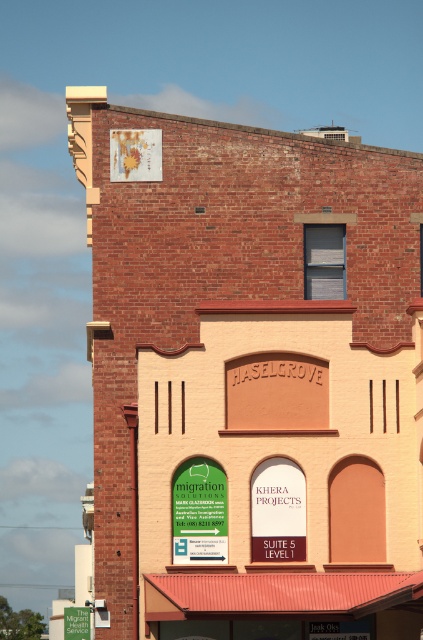
Question: Which object is positioned closest to the green plastic sign at lower left?

Choices:
 (A) metallic red awning at lower center
 (B) brick building at center

Answer: (A)

Question: Which point is closer to the camera?

Choices:
 (A) brick building at center
 (B) metallic red awning at lower center

Answer: (B)

Question: Based on their relative distances, which object is nearer to the green plastic sign at lower left?

Choices:
 (A) brick building at center
 (B) metallic red awning at lower center

Answer: (B)

Question: Is brick building at center above metallic red awning at lower center?

Choices:
 (A) yes
 (B) no

Answer: (A)

Question: Can you confirm if metallic red awning at lower center is bigger than green plastic sign at lower left?

Choices:
 (A) no
 (B) yes

Answer: (B)

Question: Can you confirm if brick building at center is smaller than green plastic sign at lower left?

Choices:
 (A) no
 (B) yes

Answer: (A)